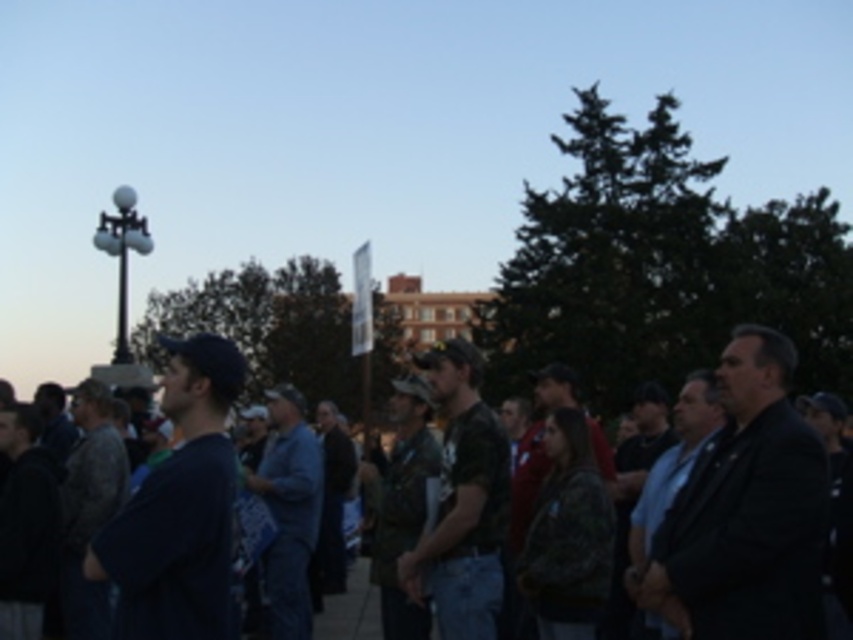
Measure the distance from dark gray suit at right to dark blue shirt at left.

dark gray suit at right and dark blue shirt at left are 20.23 meters apart.

Between dark gray suit at right and dark blue shirt at left, which one appears on the left side from the viewer's perspective?

From the viewer's perspective, dark blue shirt at left appears more on the left side.

Between point (805, 433) and point (128, 560), which one is positioned behind?

Point (805, 433)

Find the location of a particular element. The height and width of the screenshot is (640, 853). dark gray suit at right is located at coordinates (746, 512).

Which is above, dark blue shirt at left or camouflage fabric shirt at center?

dark blue shirt at left

Locate an element on the screen. dark blue shirt at left is located at coordinates (178, 508).

Who is shorter, dark gray suit at right or denim jacket at center?

denim jacket at center

Can you confirm if dark gray suit at right is wider than denim jacket at center?

Yes, dark gray suit at right is wider than denim jacket at center.

The height and width of the screenshot is (640, 853). Describe the element at coordinates (746, 512) in the screenshot. I see `dark gray suit at right` at that location.

Identify the location of dark gray suit at right. (746, 512).